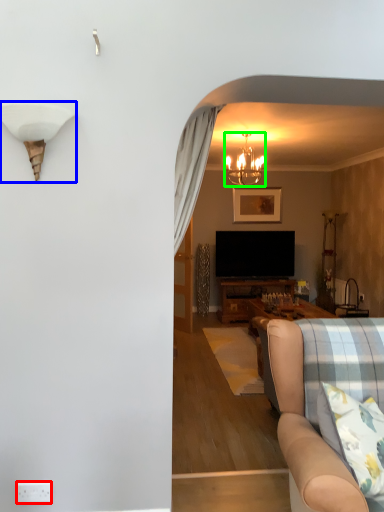
Question: Which object is the farthest from power outlet (highlighted by a red box)? Choose among these: lamp (highlighted by a blue box) or lamp (highlighted by a green box).

Choices:
 (A) lamp
 (B) lamp

Answer: (B)